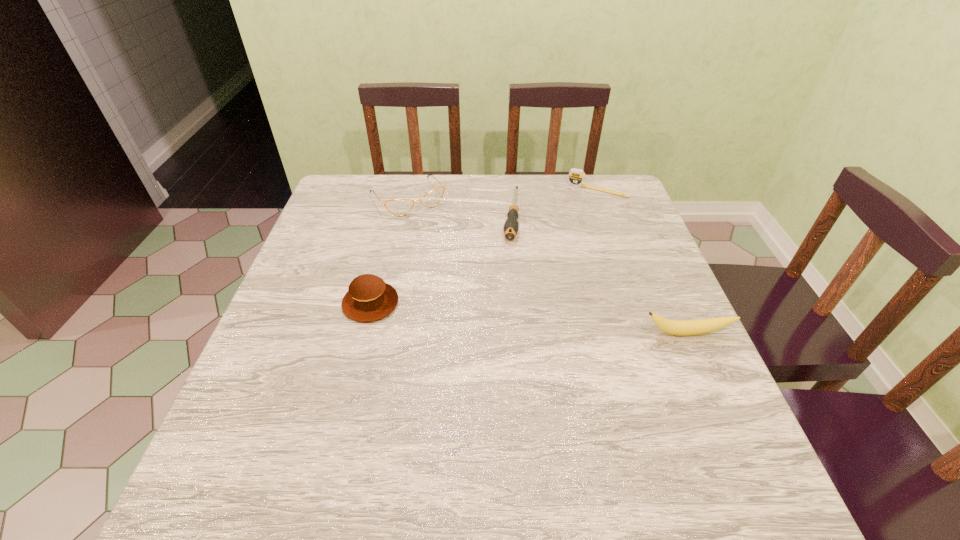
I want to click on the fourth farthest object, so click(369, 298).

Where is `banana`? This screenshot has width=960, height=540. banana is located at coordinates (674, 327).

This screenshot has width=960, height=540. I want to click on screwdriver, so click(x=511, y=226).

Find the location of a particular element. the third object from right to left is located at coordinates (511, 226).

This screenshot has height=540, width=960. I want to click on spectacles, so click(399, 207).

I want to click on the second shortest object, so click(x=576, y=177).

The height and width of the screenshot is (540, 960). What are the coordinates of `free region located 0.260m on the front of the fourth farthest object` in the screenshot? It's located at (337, 437).

What are the coordinates of `free spot located 0.130m on the upward curve of the nearest object` in the screenshot? It's located at (713, 393).

Find the location of `vacant space located at the tip of the screwdriver`. vacant space located at the tip of the screwdriver is located at coordinates (501, 323).

This screenshot has width=960, height=540. I want to click on vacant region located 0.280m at the tip of the screwdriver, so click(x=501, y=323).